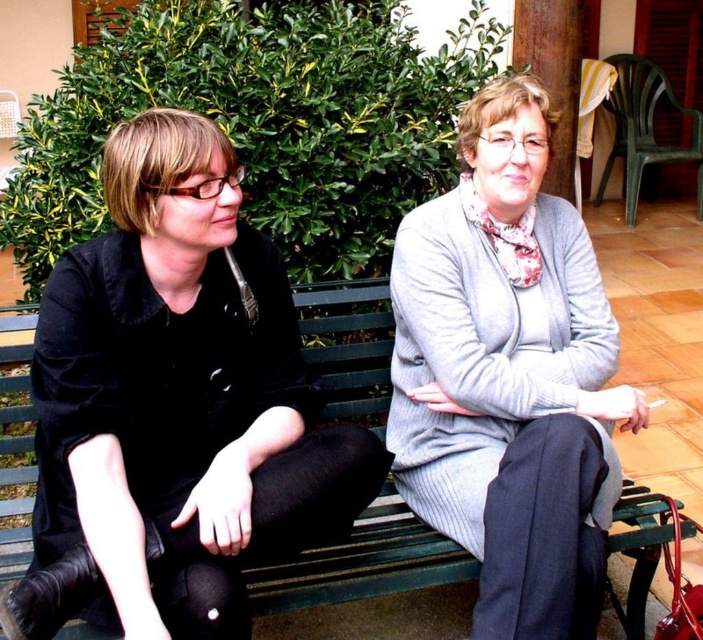
Question: Which object appears farthest from the camera in this image?

Choices:
 (A) black velvet jacket at left
 (B) green wooden bench at center
 (C) gray woolen sweater at center

Answer: (B)

Question: Is gray woolen sweater at center smaller than green wooden bench at center?

Choices:
 (A) no
 (B) yes

Answer: (A)

Question: Observing the image, what is the correct spatial positioning of black velvet jacket at left in reference to gray woolen sweater at center?

Choices:
 (A) above
 (B) below

Answer: (B)

Question: Does black velvet jacket at left have a lesser width compared to gray woolen sweater at center?

Choices:
 (A) no
 (B) yes

Answer: (A)

Question: Considering the real-world distances, which object is closest to the green wooden bench at center?

Choices:
 (A) gray woolen sweater at center
 (B) black velvet jacket at left

Answer: (A)

Question: Which point is closer to the camera taking this photo?

Choices:
 (A) (214, 301)
 (B) (553, 346)
 (C) (1, 476)

Answer: (A)